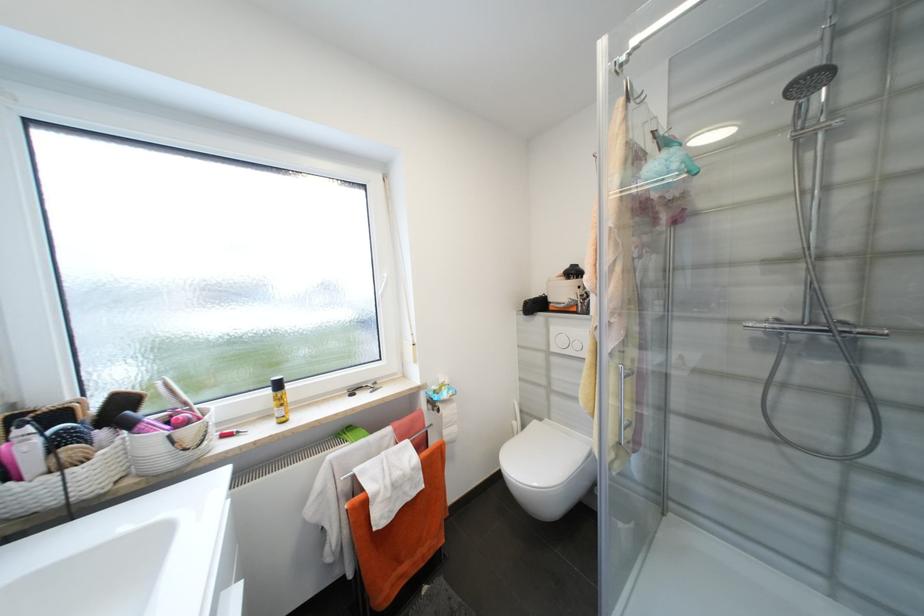
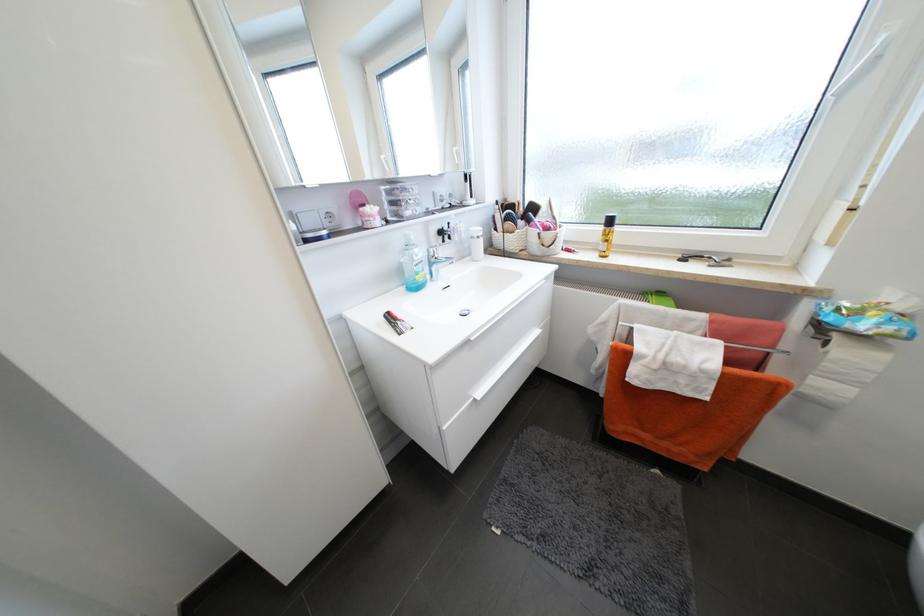
The point at (391, 276) is marked in the first image. Where is the corresponding point in the second image?

(888, 41)